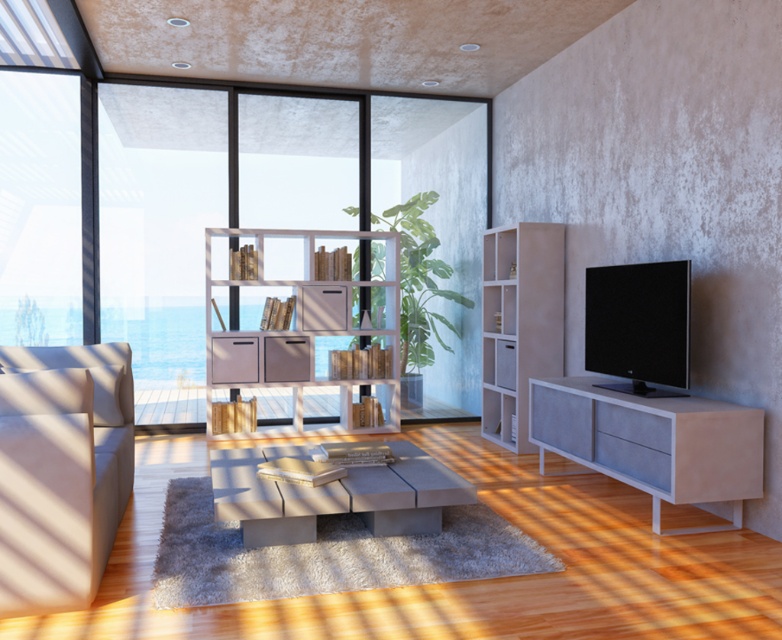
Question: Is wooden bookshelf at center to the right of concrete coffee table at center from the viewer's perspective?

Choices:
 (A) no
 (B) yes

Answer: (A)

Question: Which object is positioned farthest from the slate gray concrete cabinet at lower right?

Choices:
 (A) transparent glass window at left
 (B) white textured bookshelf at center
 (C) concrete coffee table at center

Answer: (A)

Question: Which is farther from the beige fabric couch at left?

Choices:
 (A) wooden bookshelf at center
 (B) transparent glass window at left
 (C) concrete coffee table at center

Answer: (B)

Question: Where is transparent glass window at left located in relation to beige fabric couch at left in the image?

Choices:
 (A) right
 (B) left

Answer: (B)

Question: Can you confirm if transparent glass window at left is smaller than slate gray concrete cabinet at lower right?

Choices:
 (A) no
 (B) yes

Answer: (A)

Question: Which point is farther from the camera taking this photo?

Choices:
 (A) (497, 406)
 (B) (122, 362)
 (C) (332, 492)
 (D) (160, 332)

Answer: (D)